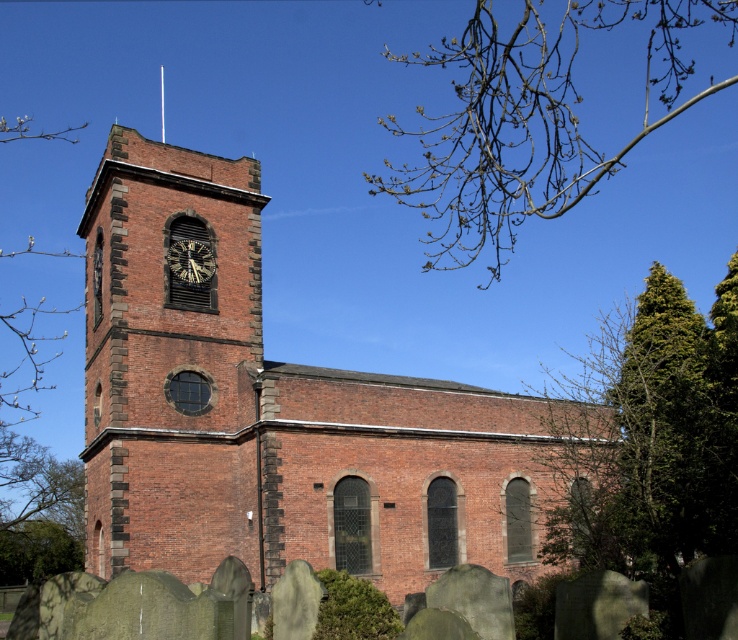
Does brick church at center have a smaller size compared to green leafy tree at right?

Yes, brick church at center is smaller than green leafy tree at right.

Does brick church at center have a larger size compared to green leafy tree at right?

Incorrect, brick church at center is not larger than green leafy tree at right.

Between point (344, 566) and point (649, 524), which one is positioned behind?

The point (344, 566) is behind.

The image size is (738, 640). What are the coordinates of `brick church at center` in the screenshot? It's located at (272, 412).

Does brown brick clock tower at left appear over green leafy tree at right?

Actually, brown brick clock tower at left is below green leafy tree at right.

Which is below, brown brick clock tower at left or green leafy tree at right?

Positioned lower is brown brick clock tower at left.

Does point (117, 480) come farther from viewer compared to point (666, 566)?

Yes, it is behind point (666, 566).

Locate an element on the screen. This screenshot has height=640, width=738. brown brick clock tower at left is located at coordinates (170, 360).

Is green leafy tree at right to the right of bare branches at upper right from the viewer's perspective?

Correct, you'll find green leafy tree at right to the right of bare branches at upper right.

Is green leafy tree at right shorter than bare branches at upper right?

Yes.

Who is more forward, (728, 448) or (432, 209)?

Positioned in front is point (728, 448).

Find the location of a particular element. The height and width of the screenshot is (640, 738). green leafy tree at right is located at coordinates (655, 452).